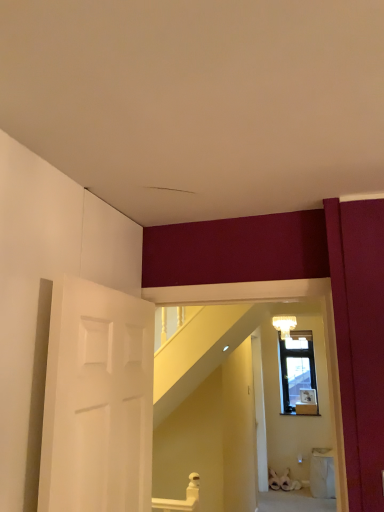
Identify the location of white matte door at center. (259, 411).

In order to face white matte door at center, should I rotate leftwards or rightwards?

Rotate right and turn 8.593 degrees.

This screenshot has width=384, height=512. Describe the element at coordinates (259, 411) in the screenshot. I see `white matte door at center` at that location.

Where is `white frosted glass light fixture at upper center`? This screenshot has height=512, width=384. white frosted glass light fixture at upper center is located at coordinates (284, 325).

Measure the distance between white frosted glass light fixture at upper center and camera.

They are 4.41 meters apart.

This screenshot has width=384, height=512. What do you see at coordinates (284, 325) in the screenshot?
I see `white frosted glass light fixture at upper center` at bounding box center [284, 325].

Identify the location of white matte door at center. (259, 411).

Considering the relative positions of white frosted glass light fixture at upper center and white matte door at center in the image provided, is white frosted glass light fixture at upper center to the left of white matte door at center from the viewer's perspective?

No, white frosted glass light fixture at upper center is not to the left of white matte door at center.

Is white frosted glass light fixture at upper center closer to the viewer compared to white matte door at center?

No, white frosted glass light fixture at upper center is behind white matte door at center.

Which is closer, (287, 324) or (256, 370)?

Point (287, 324) appears to be farther away from the viewer than point (256, 370).

From the image's perspective, which one is positioned lower, white frosted glass light fixture at upper center or white matte door at center?

white matte door at center.

From a real-world perspective, who is located lower, white frosted glass light fixture at upper center or white matte door at center?

white matte door at center.

Considering the sizes of objects white frosted glass light fixture at upper center and white matte door at center in the image provided, who is wider, white frosted glass light fixture at upper center or white matte door at center?

Wider between the two is white frosted glass light fixture at upper center.

Looking at this image, which of these two, white frosted glass light fixture at upper center or white matte door at center, stands shorter?

white frosted glass light fixture at upper center is shorter.

Between white frosted glass light fixture at upper center and white matte door at center, which one has smaller size?

white frosted glass light fixture at upper center.

Is white matte door at center located within white frosted glass light fixture at upper center?

No.

Are white frosted glass light fixture at upper center and white matte door at center far apart?

Actually, white frosted glass light fixture at upper center and white matte door at center are a little close together.

Is white frosted glass light fixture at upper center oriented away from white matte door at center?

white frosted glass light fixture at upper center does not have its back to white matte door at center.

How distant is white frosted glass light fixture at upper center from white matte door at center?

They are 88.69 centimeters apart.

What are the coordinates of `door on the left of white frosted glass light fixture at upper center` in the screenshot? It's located at (259, 411).

Visually, is white matte door at center positioned to the left or to the right of white frosted glass light fixture at upper center?

In the image, white matte door at center appears on the left side of white frosted glass light fixture at upper center.

Does white matte door at center come behind white frosted glass light fixture at upper center?

No, white matte door at center is closer to the camera.

Which is behind, point (256, 402) or point (285, 322)?

The point (285, 322) is more distant.

From the image's perspective, who appears lower, white matte door at center or white frosted glass light fixture at upper center?

From the image's view, white matte door at center is below.

From a real-world perspective, is white matte door at center above or below white frosted glass light fixture at upper center?

In terms of real-world spatial position, white matte door at center is below white frosted glass light fixture at upper center.

Considering the relative sizes of white matte door at center and white frosted glass light fixture at upper center in the image provided, is white matte door at center wider than white frosted glass light fixture at upper center?

Incorrect, the width of white matte door at center does not surpass that of white frosted glass light fixture at upper center.

Considering the relative sizes of white matte door at center and white frosted glass light fixture at upper center in the image provided, is white matte door at center shorter than white frosted glass light fixture at upper center?

Incorrect, the height of white matte door at center does not fall short of that of white frosted glass light fixture at upper center.

In terms of size, does white matte door at center appear bigger or smaller than white frosted glass light fixture at upper center?

In the image, white matte door at center appears to be larger than white frosted glass light fixture at upper center.

Is white frosted glass light fixture at upper center surrounded by white matte door at center?

No, white matte door at center does not contain white frosted glass light fixture at upper center.

Is the surface of white matte door at center in direct contact with white frosted glass light fixture at upper center?

There is a gap between white matte door at center and white frosted glass light fixture at upper center.

Is white matte door at center oriented towards white frosted glass light fixture at upper center?

No, white matte door at center does not turn towards white frosted glass light fixture at upper center.

At what (x,y) coordinates should I click in order to perform the action: click on door that appears below the white frosted glass light fixture at upper center (from a real-world perspective). Please return your answer as a coordinate pair (x, y). Looking at the image, I should click on (259, 411).

Find the location of a particular element. This screenshot has width=384, height=512. door below the white frosted glass light fixture at upper center (from the image's perspective) is located at coordinates (259, 411).

There is a white matte door at center. At what (x,y) coordinates should I click in order to perform the action: click on light fixture above it (from a real-world perspective). Please return your answer as a coordinate pair (x, y). The width and height of the screenshot is (384, 512). Looking at the image, I should click on (284, 325).